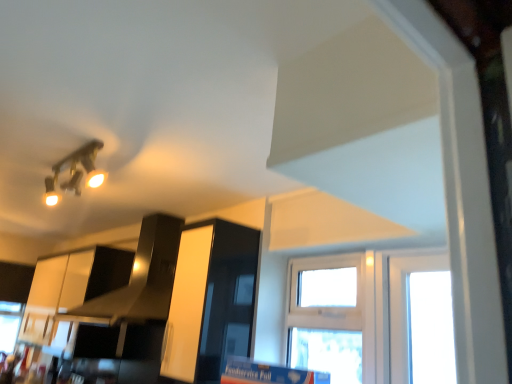
Question: Is black glossy exhaust hood at upper center placed right next to white plastic window at center?

Choices:
 (A) no
 (B) yes

Answer: (A)

Question: Is black glossy exhaust hood at upper center closer to camera compared to white plastic window at center?

Choices:
 (A) yes
 (B) no

Answer: (B)

Question: Can you confirm if black glossy exhaust hood at upper center is taller than white plastic window at center?

Choices:
 (A) no
 (B) yes

Answer: (B)

Question: Is black glossy exhaust hood at upper center located outside white plastic window at center?

Choices:
 (A) yes
 (B) no

Answer: (A)

Question: Does black glossy exhaust hood at upper center have a lesser width compared to white plastic window at center?

Choices:
 (A) yes
 (B) no

Answer: (B)

Question: Considering the relative positions of black glossy exhaust hood at upper center and glossy white cabinet at center in the image provided, is black glossy exhaust hood at upper center to the left or to the right of glossy white cabinet at center?

Choices:
 (A) right
 (B) left

Answer: (B)

Question: In terms of width, does black glossy exhaust hood at upper center look wider or thinner when compared to glossy white cabinet at center?

Choices:
 (A) wide
 (B) thin

Answer: (A)

Question: Considering the positions of point (157, 251) and point (179, 288), is point (157, 251) closer or farther from the camera than point (179, 288)?

Choices:
 (A) farther
 (B) closer

Answer: (A)

Question: From a real-world perspective, is black glossy exhaust hood at upper center above or below glossy white cabinet at center?

Choices:
 (A) below
 (B) above

Answer: (B)

Question: Considering the positions of point (148, 299) and point (293, 306), is point (148, 299) closer or farther from the camera than point (293, 306)?

Choices:
 (A) farther
 (B) closer

Answer: (A)

Question: In terms of width, does black glossy exhaust hood at upper center look wider or thinner when compared to white plastic window at center?

Choices:
 (A) thin
 (B) wide

Answer: (B)

Question: In terms of height, does black glossy exhaust hood at upper center look taller or shorter compared to white plastic window at center?

Choices:
 (A) short
 (B) tall

Answer: (B)

Question: Is black glossy exhaust hood at upper center inside or outside of white plastic window at center?

Choices:
 (A) inside
 (B) outside

Answer: (B)

Question: Is white plastic window at center bigger or smaller than black glossy exhaust hood at upper center?

Choices:
 (A) big
 (B) small

Answer: (B)

Question: Is white plastic window at center wider or thinner than black glossy exhaust hood at upper center?

Choices:
 (A) thin
 (B) wide

Answer: (A)